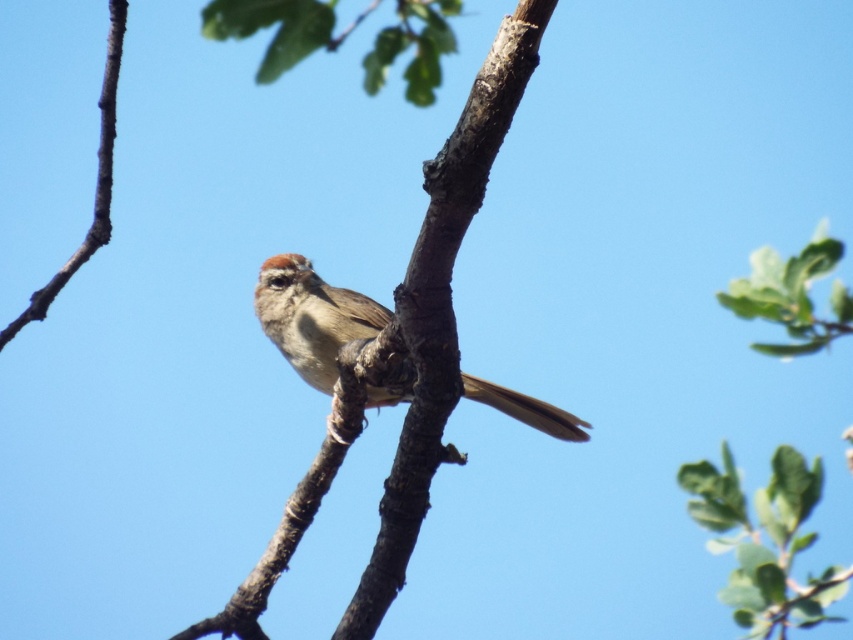
Can you confirm if green leafy branch at upper right is positioned to the left of brown speckled sparrow at center?

In fact, green leafy branch at upper right is to the right of brown speckled sparrow at center.

The image size is (853, 640). What do you see at coordinates (767, 538) in the screenshot?
I see `green leafy branch at upper right` at bounding box center [767, 538].

Where is `green leafy branch at upper right`? This screenshot has height=640, width=853. green leafy branch at upper right is located at coordinates (767, 538).

Is brown rough branch at center above green leafy branch at upper right?

Correct, brown rough branch at center is located above green leafy branch at upper right.

Locate an element on the screen. The image size is (853, 640). brown rough branch at center is located at coordinates (405, 355).

Who is more forward, (387, 568) or (746, 595)?

Positioned in front is point (387, 568).

This screenshot has height=640, width=853. I want to click on brown rough branch at center, so click(405, 355).

Is brown rough branch at center further to camera compared to brown speckled sparrow at center?

No.

Which is more to the right, brown rough branch at center or brown speckled sparrow at center?

brown speckled sparrow at center is more to the right.

Is point (440, 209) closer to camera compared to point (291, 252)?

Yes, it is in front of point (291, 252).

At what (x,y) coordinates should I click in order to perform the action: click on brown rough branch at center. Please return your answer as a coordinate pair (x, y). Looking at the image, I should click on (405, 355).